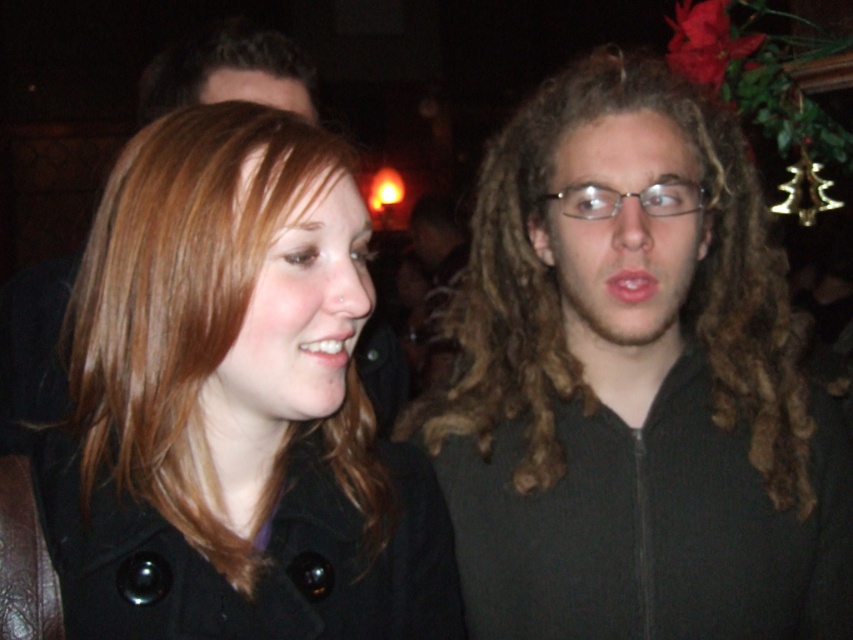
Question: In this image, where is matte black coat at left located relative to clear plastic glasses at center?

Choices:
 (A) above
 (B) below

Answer: (B)

Question: In this image, where is matte black coat at left located relative to curly brown hair at center?

Choices:
 (A) below
 (B) above

Answer: (A)

Question: Which object appears closest to the camera in this image?

Choices:
 (A) matte black coat at left
 (B) curly brown hair at center
 (C) clear plastic glasses at center

Answer: (A)

Question: Among these objects, which one is farthest from the camera?

Choices:
 (A) matte black coat at left
 (B) curly brown hair at center
 (C) clear plastic glasses at center

Answer: (B)

Question: Does matte black coat at left lie behind clear plastic glasses at center?

Choices:
 (A) yes
 (B) no

Answer: (B)

Question: Which point is closer to the camera?

Choices:
 (A) curly brown hair at center
 (B) matte black coat at left

Answer: (B)